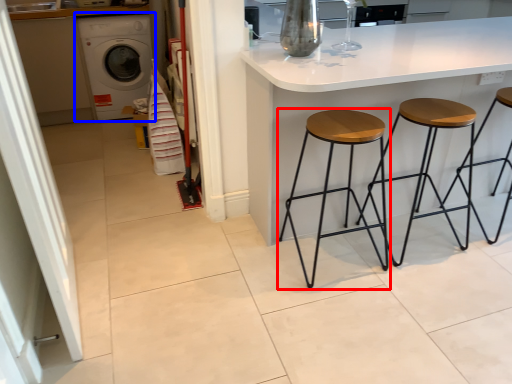
Question: Which object appears farthest to the camera in this image, stool (highlighted by a red box) or washing machine (highlighted by a blue box)?

Choices:
 (A) stool
 (B) washing machine

Answer: (B)